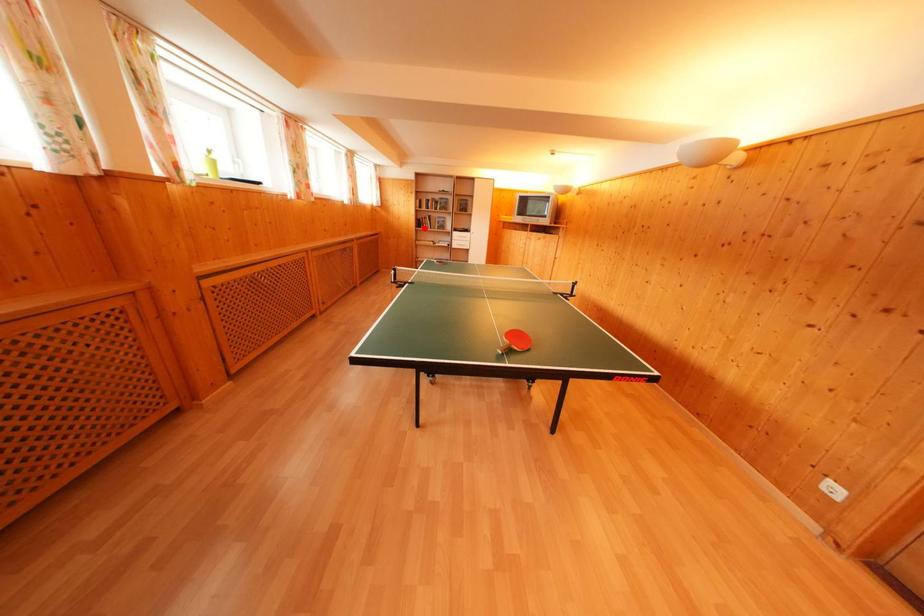
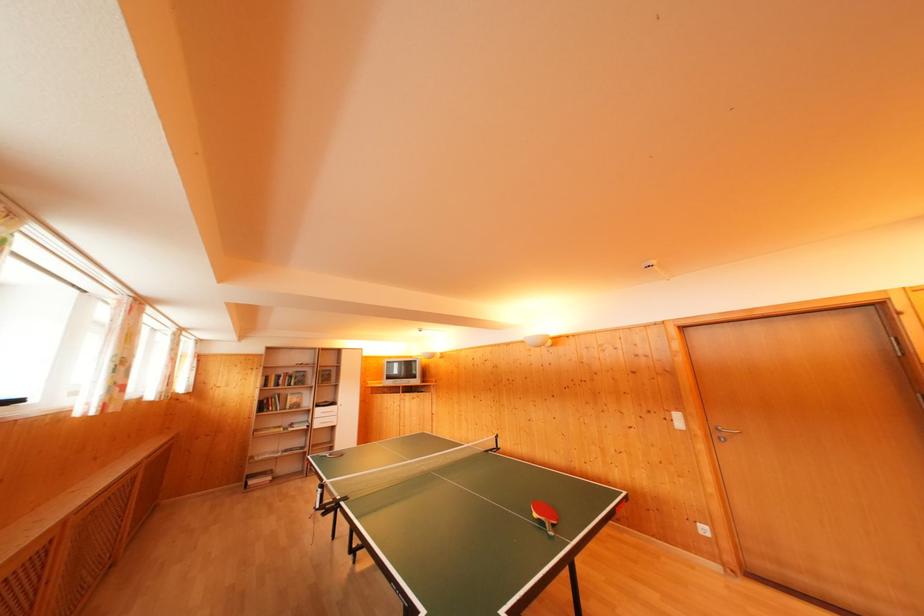
Locate, in the second image, the point that corresponds to the highlighted location in the first image.

(268, 411)